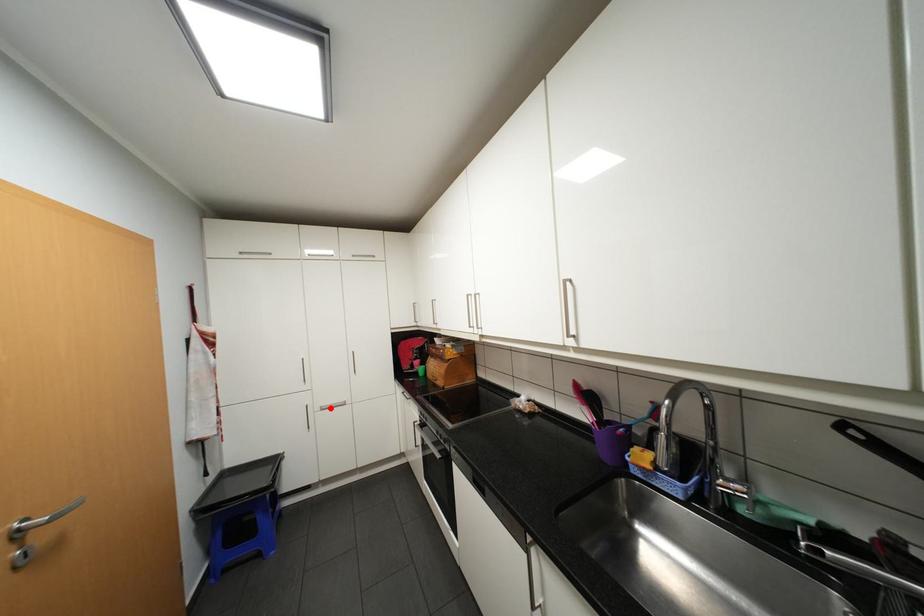
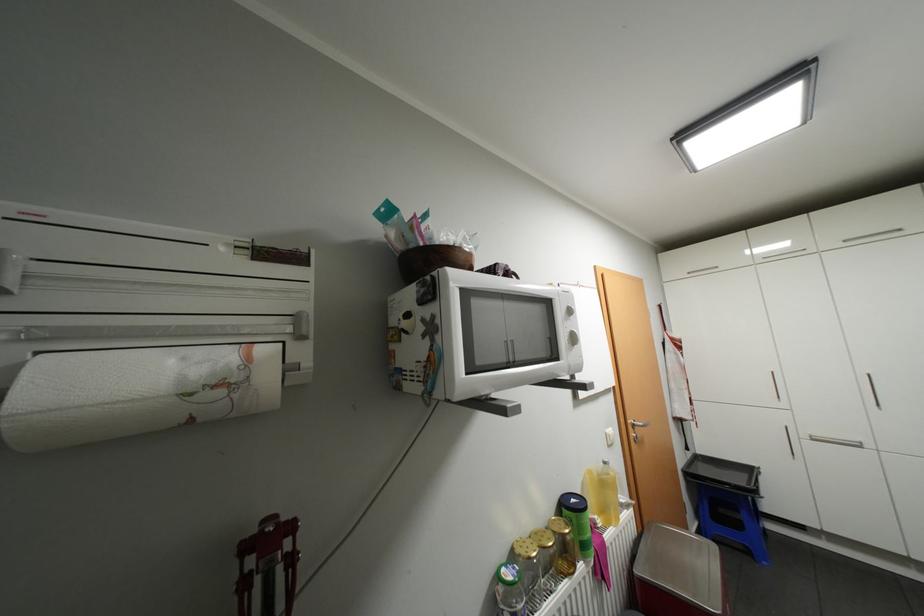
Find the pixel in the second image that matches the highlighted location in the first image.

(821, 438)